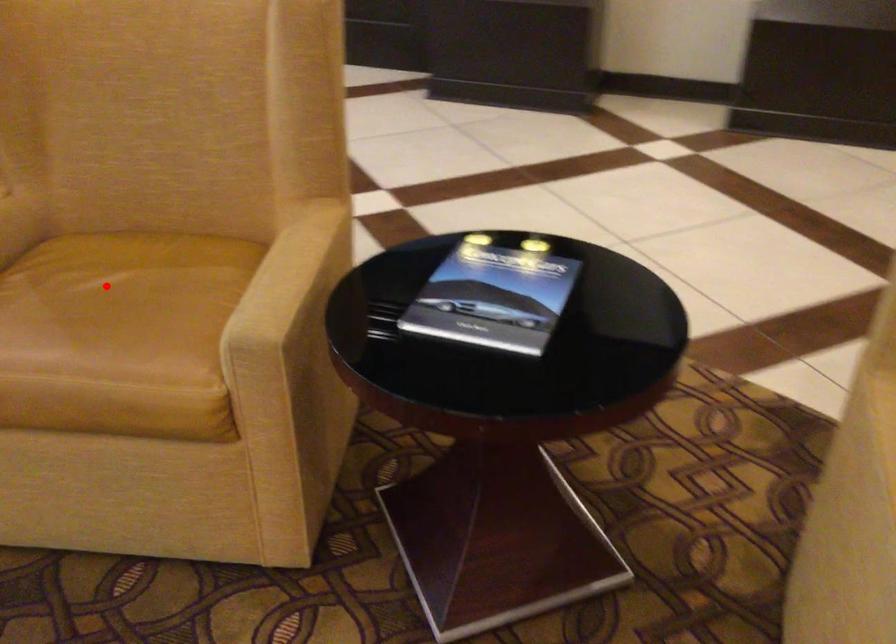
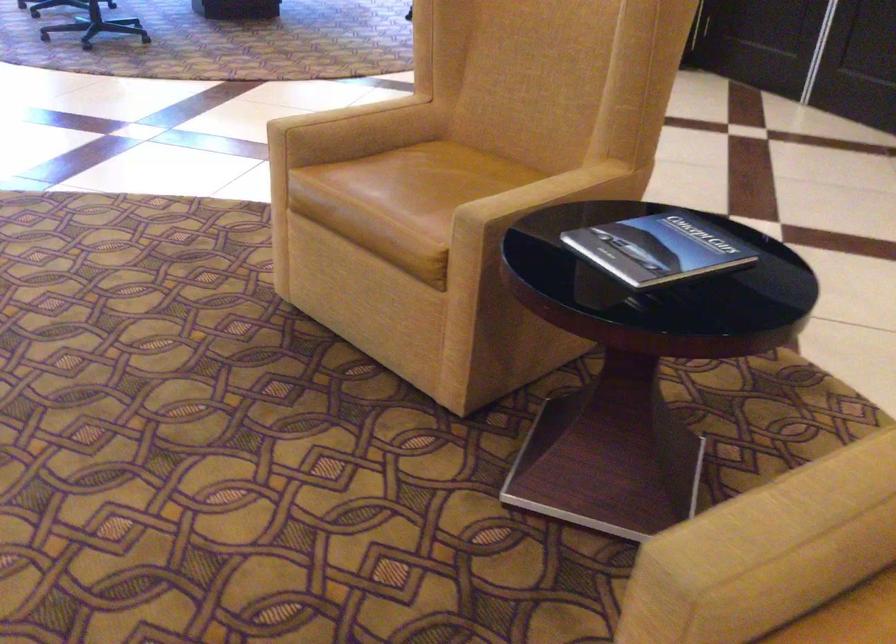
Question: I am providing you with two images of the same scene from different viewpoints. Given a red point in image1, look at the same physical point in image2. Is it:

Choices:
 (A) Closer to the viewpoint
 (B) Farther from the viewpoint

Answer: (B)